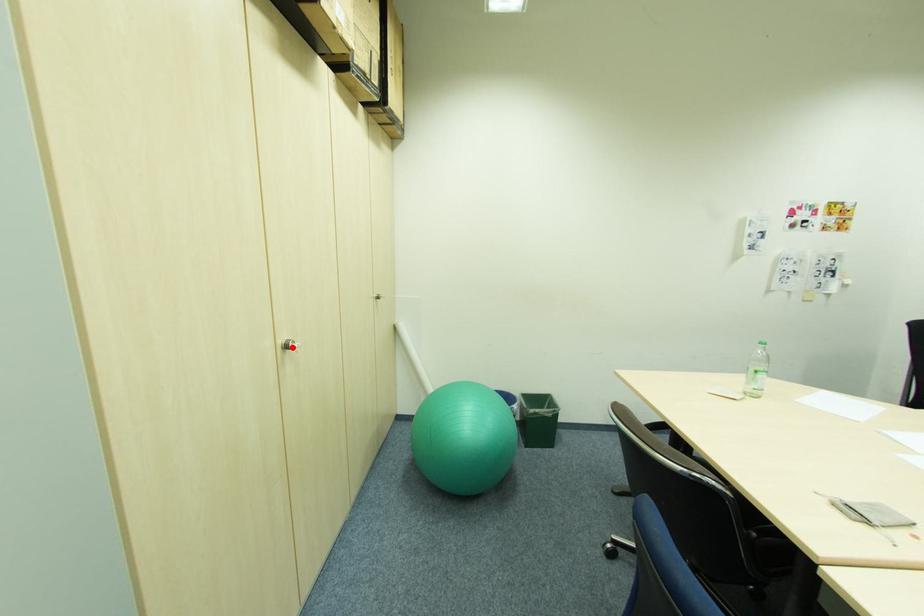
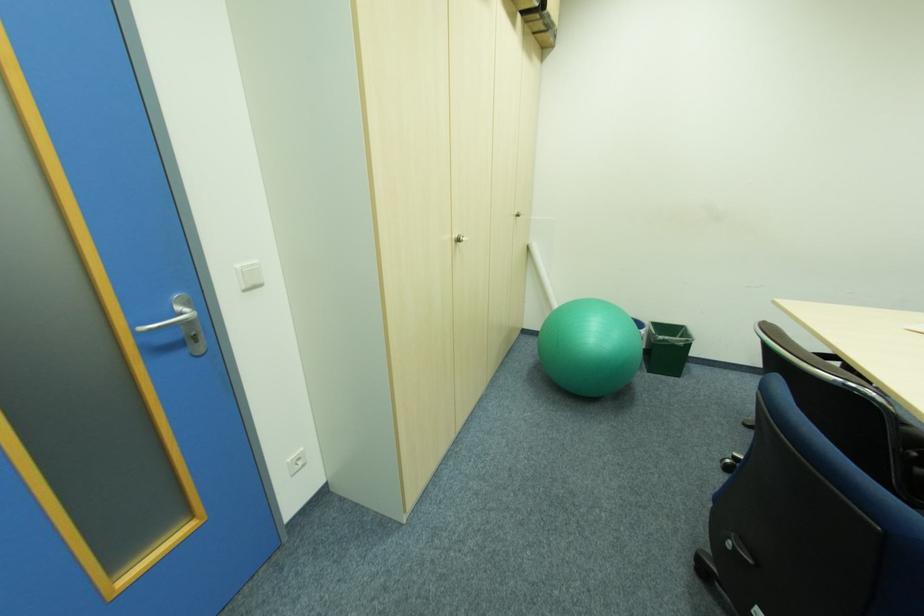
In the second image, find the point that corresponds to the highlighted location in the first image.

(464, 241)